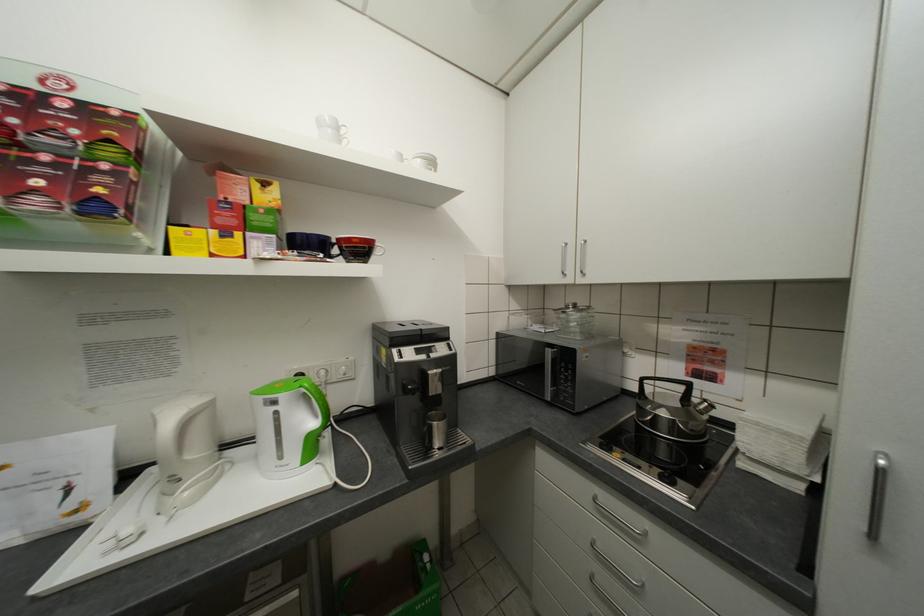
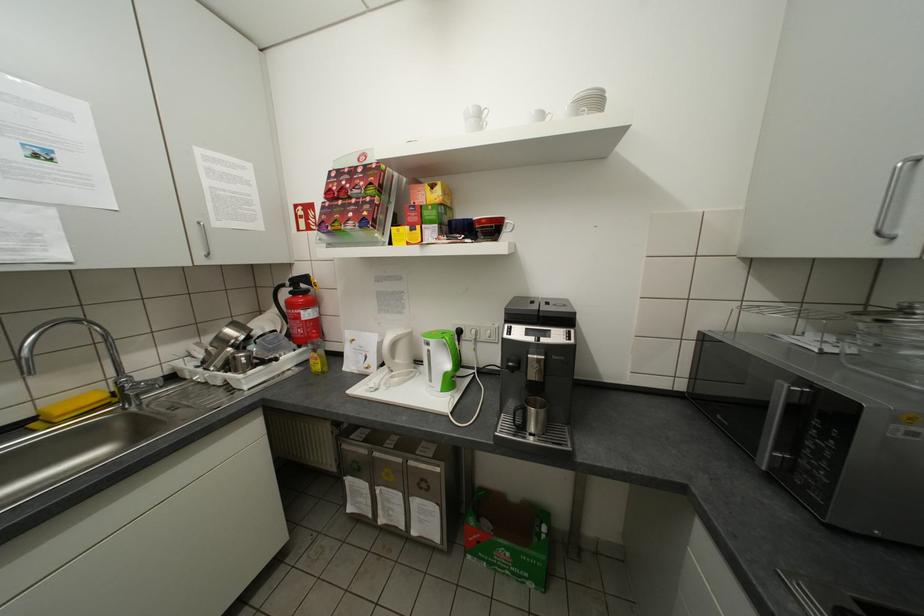
The point at (196, 493) is marked in the first image. Where is the corresponding point in the second image?

(406, 379)